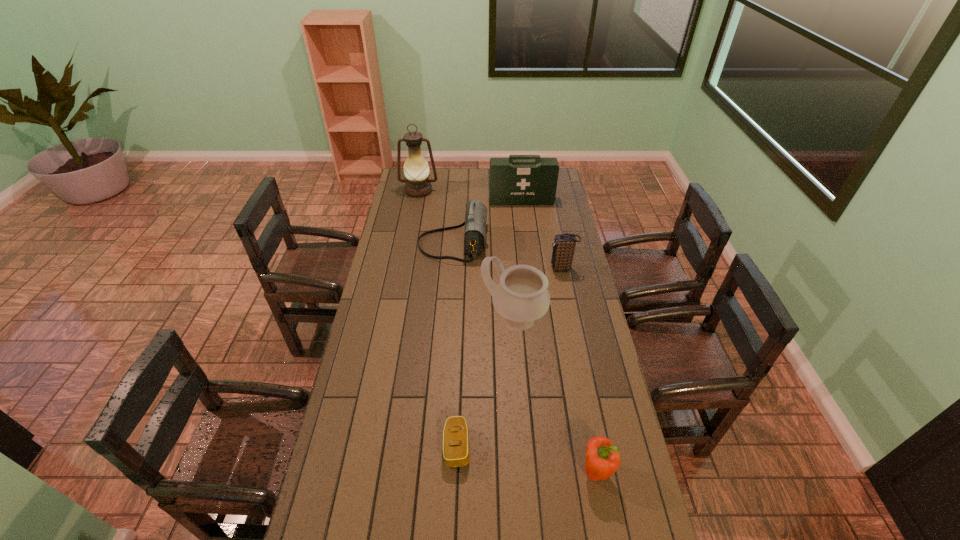
This screenshot has height=540, width=960. What are the coordinates of `oil lamp` in the screenshot? It's located at (416, 169).

Where is `the first-aid kit`? The image size is (960, 540). the first-aid kit is located at coordinates (520, 179).

Where is `the fifth farthest object`? The image size is (960, 540). the fifth farthest object is located at coordinates (521, 296).

Identify the location of shoulder bag. (475, 232).

The height and width of the screenshot is (540, 960). Identify the location of the right clutch bag. (564, 244).

Identify the location of the taller clutch bag. The image size is (960, 540). (564, 244).

Locate an element on the screen. The image size is (960, 540). pepper is located at coordinates (602, 458).

This screenshot has height=540, width=960. Find the location of `the nearer clutch bag`. the nearer clutch bag is located at coordinates (456, 451).

Identify the location of the left clutch bag. The image size is (960, 540). (456, 451).

Locate an element on the screen. This screenshot has height=540, width=960. free region located 0.350m on the right of the oil lamp is located at coordinates (502, 191).